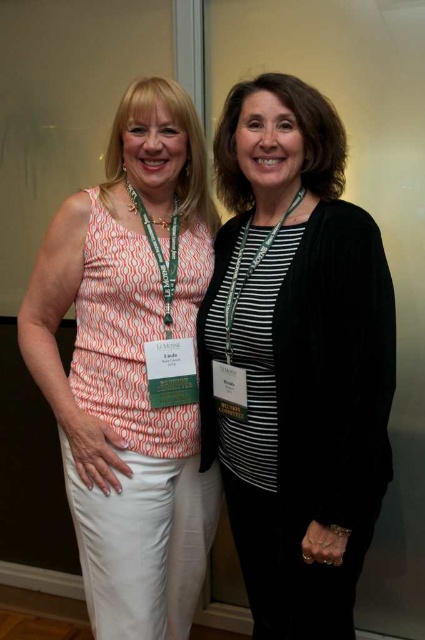
You are a fashion designer observing two women at a conference. You notice the black velvet cardigan at center and the white cotton tank top at center. Which clothing item is smaller in size?

The black velvet cardigan at center is smaller than the white cotton tank top at center.